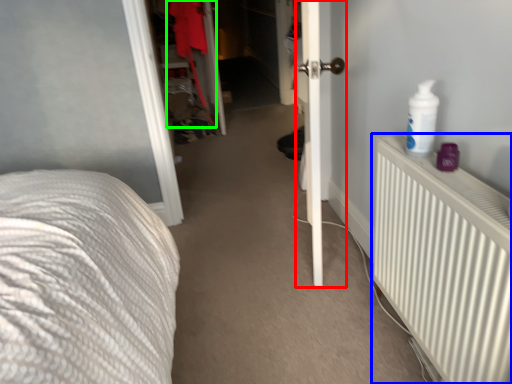
Question: Which is farther away from door (highlighted by a red box)? radiator (highlighted by a blue box) or clothing (highlighted by a green box)?

Choices:
 (A) radiator
 (B) clothing

Answer: (B)